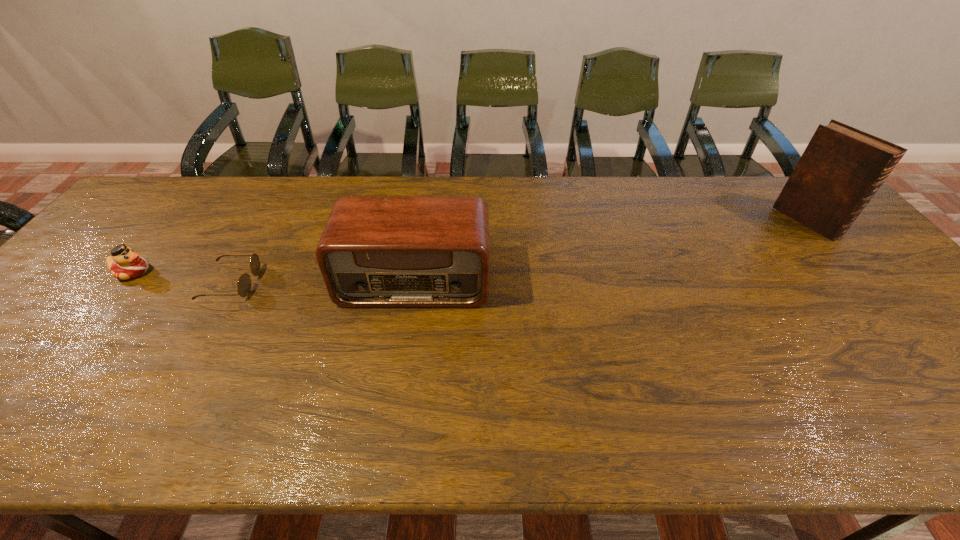
Identify the location of Bible. (841, 169).

The height and width of the screenshot is (540, 960). What are the coordinates of `the tallest object` in the screenshot? It's located at (841, 169).

Where is `the third shortest object`? This screenshot has height=540, width=960. the third shortest object is located at coordinates (374, 251).

Locate an element on the screen. Image resolution: width=960 pixels, height=540 pixels. radio receiver is located at coordinates (374, 251).

The width and height of the screenshot is (960, 540). I want to click on the leftmost object, so click(124, 263).

You are a GUI agent. You are given a task and a screenshot of the screen. Output one action in this format:
    pyautogui.click(x=<x>, y=<y>)
    Task: Click on the third tallest object
    
    Given the screenshot: What is the action you would take?
    pyautogui.click(x=124, y=263)

Locate an element on the screen. This screenshot has width=960, height=540. the shortest object is located at coordinates (244, 284).

The image size is (960, 540). What are the coordinates of `the third object from right to left` in the screenshot? It's located at (244, 284).

Locate an element on the screen. This screenshot has width=960, height=540. vacant position located 0.180m on the front of the tallest object is located at coordinates (863, 286).

Locate an element on the screen. vacant region located on the front panel of the third shortest object is located at coordinates (392, 435).